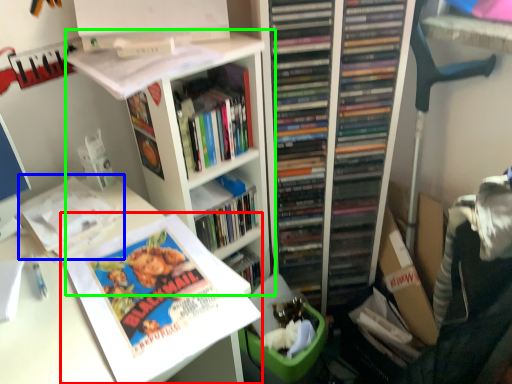
Question: Which is nearer to the book (highlighted by a red box)? book (highlighted by a blue box) or bookshelf (highlighted by a green box).

Choices:
 (A) book
 (B) bookshelf

Answer: (A)